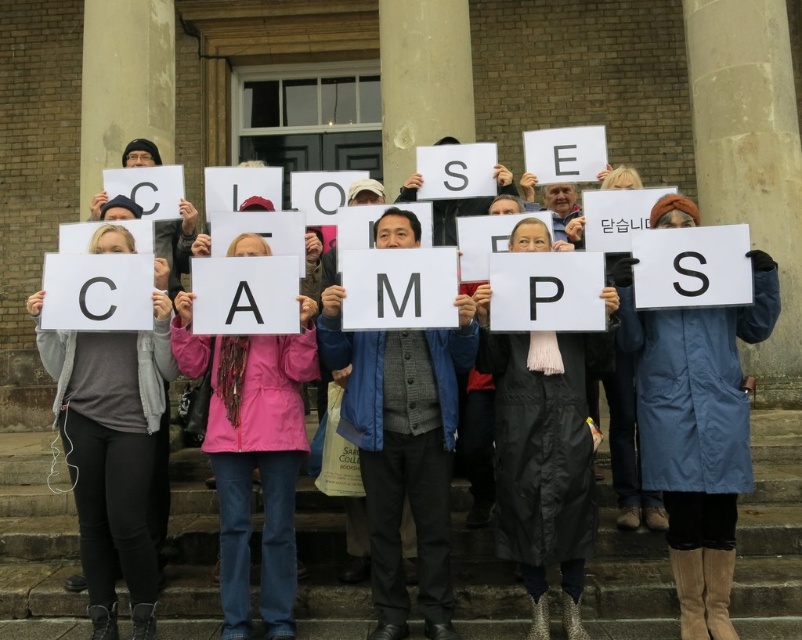
Which is above, blue fabric coat at center or matte gray jacket at center?

blue fabric coat at center is higher up.

Which is more to the left, blue fabric coat at center or matte gray jacket at center?

Positioned to the left is matte gray jacket at center.

Which is in front, point (743, 422) or point (404, 344)?

Point (743, 422) is more forward.

What are the coordinates of `blue fabric coat at center` in the screenshot? It's located at (695, 432).

This screenshot has width=802, height=640. Identify the location of black matte coat at center. (543, 456).

Between black matte coat at center and gray fabric at center, which one has more height?

gray fabric at center is taller.

Is point (574, 451) more distant than point (114, 362)?

No, (574, 451) is in front of (114, 362).

Identify the location of black matte coat at center. (543, 456).

Is white paper sign at center bigger than pink fabric jacket at center?

Correct, white paper sign at center is larger in size than pink fabric jacket at center.

Is white paper sign at center positioned at the back of pink fabric jacket at center?

That is False.

Does point (240, 413) come closer to viewer compared to point (225, 515)?

No, (240, 413) is behind (225, 515).

You are a GUI agent. You are given a task and a screenshot of the screen. Output one action in this format:
    pyautogui.click(x=<x>, y=<y>)
    Task: Click on the white paper sign at center
    The width and height of the screenshot is (802, 640).
    Given the screenshot: What is the action you would take?
    pyautogui.click(x=316, y=560)